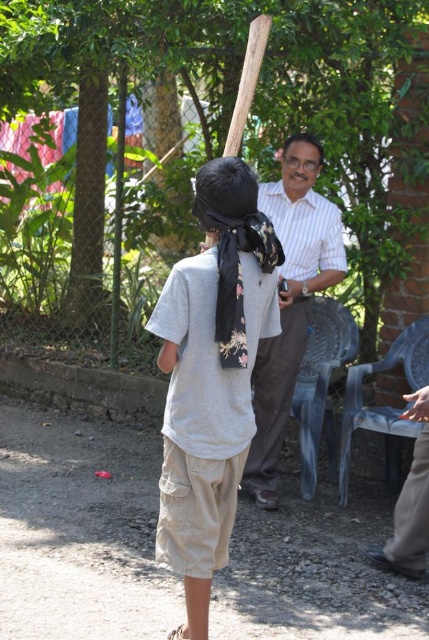
You are trying to determine which object takes up more space in the image. Looking at the gray cotton shirt at center and the wooden baseball bat at upper center, which one is bigger in size?

The gray cotton shirt at center is larger in size than the wooden baseball bat at upper center according to the description.

You are looking at the image and notice two shirts in the scene. The gray cotton shirt at center and the white striped shirt at center. Which shirt is positioned lower in the image?

The gray cotton shirt at center is located below the white striped shirt at center, so the gray cotton shirt at center is positioned lower in the image.

Based on the photo, you are a photographer trying to capture a clear shot of both the white striped shirt at center and the wooden baseball bat at upper center. Since you want to ensure both are visible, which object should you focus on first to account for their sizes?

The white striped shirt at center is bigger than the wooden baseball bat at upper center, so you should focus on the wooden baseball bat at upper center first since it is smaller and might require more precise framing to ensure visibility.